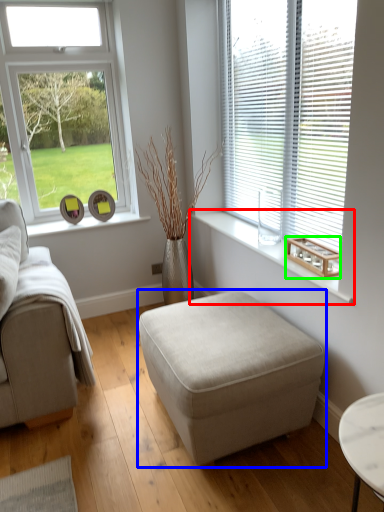
Question: Based on their relative distances, which object is nearer to window sill (highlighted by a red box)? Choose from table (highlighted by a blue box) and wood (highlighted by a green box).

Choices:
 (A) table
 (B) wood

Answer: (B)